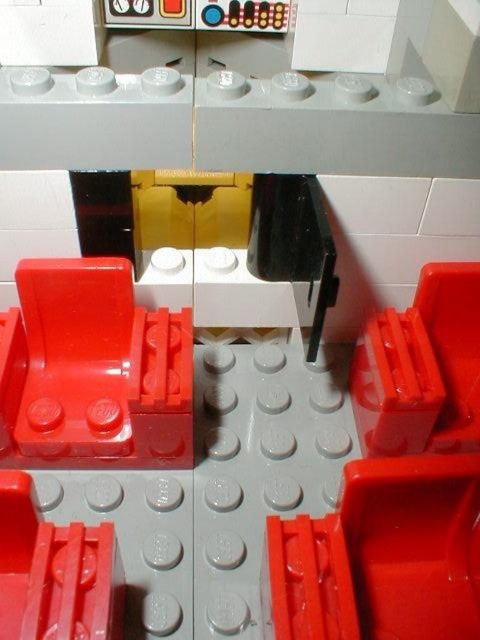
In the scene shown: Who is higher up, matte red hinge at center or matte red hinge at lower left?

Positioned higher is matte red hinge at center.

Is matte red hinge at center behind matte red hinge at lower left?

That is True.

The image size is (480, 640). Describe the element at coordinates (93, 371) in the screenshot. I see `matte red hinge at center` at that location.

In order to click on matte red hinge at center in this screenshot , I will do `click(93, 371)`.